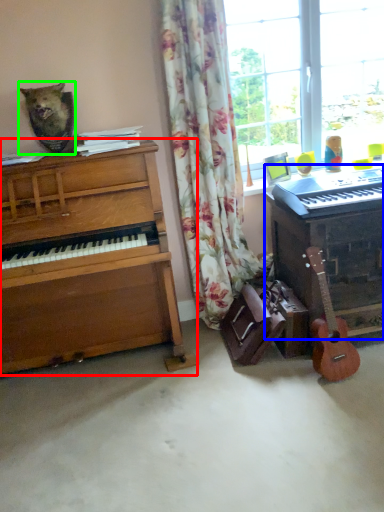
Question: Which is nearer to the piano (highlighted by a red box)? piano (highlighted by a blue box) or animal (highlighted by a green box).

Choices:
 (A) piano
 (B) animal

Answer: (B)